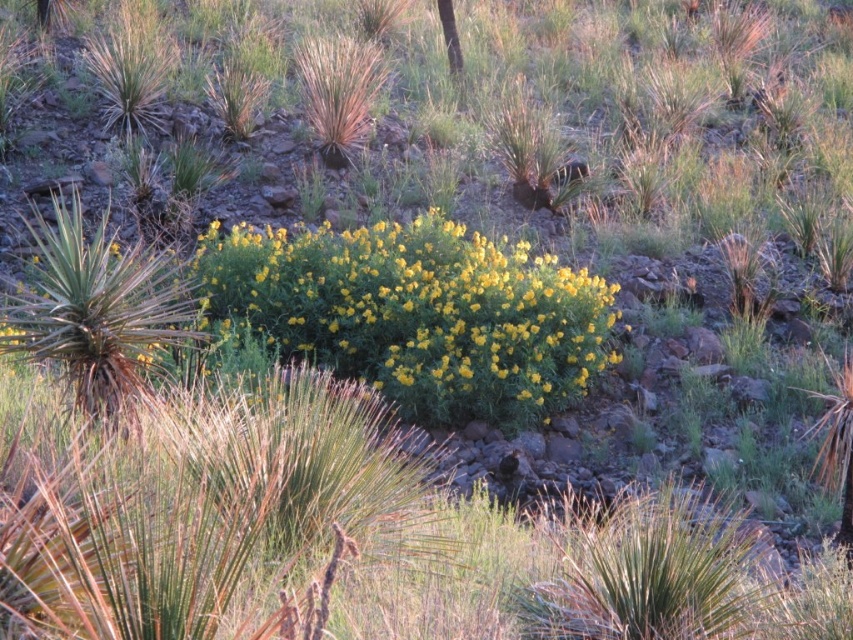
Is yellow-green leafy bush at center positioned in front of green leafy tree at upper center?

Yes, yellow-green leafy bush at center is in front of green leafy tree at upper center.

Can you confirm if yellow-green leafy bush at center is taller than green leafy tree at upper center?

Correct, yellow-green leafy bush at center is much taller as green leafy tree at upper center.

The width and height of the screenshot is (853, 640). What do you see at coordinates (418, 314) in the screenshot? I see `yellow-green leafy bush at center` at bounding box center [418, 314].

I want to click on yellow-green leafy bush at center, so click(x=418, y=314).